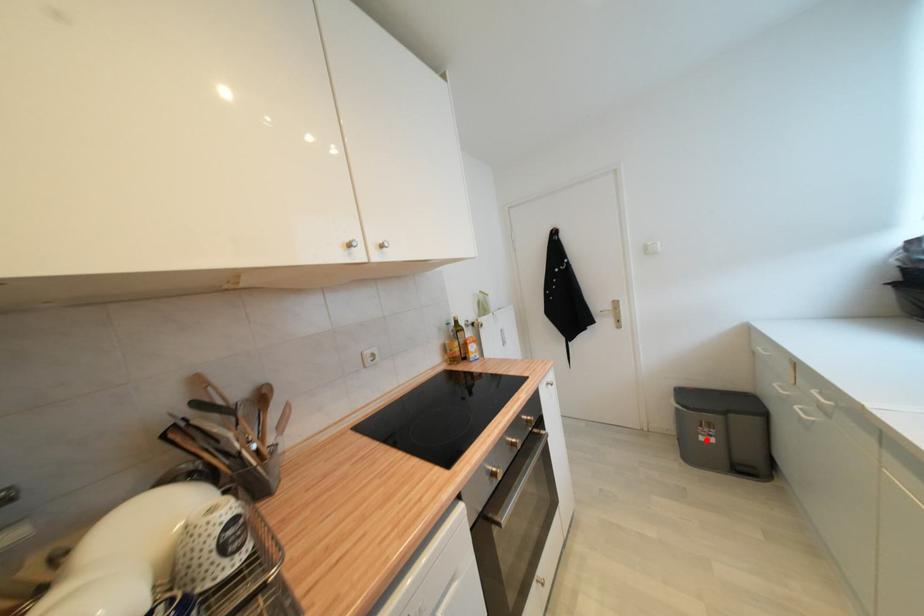
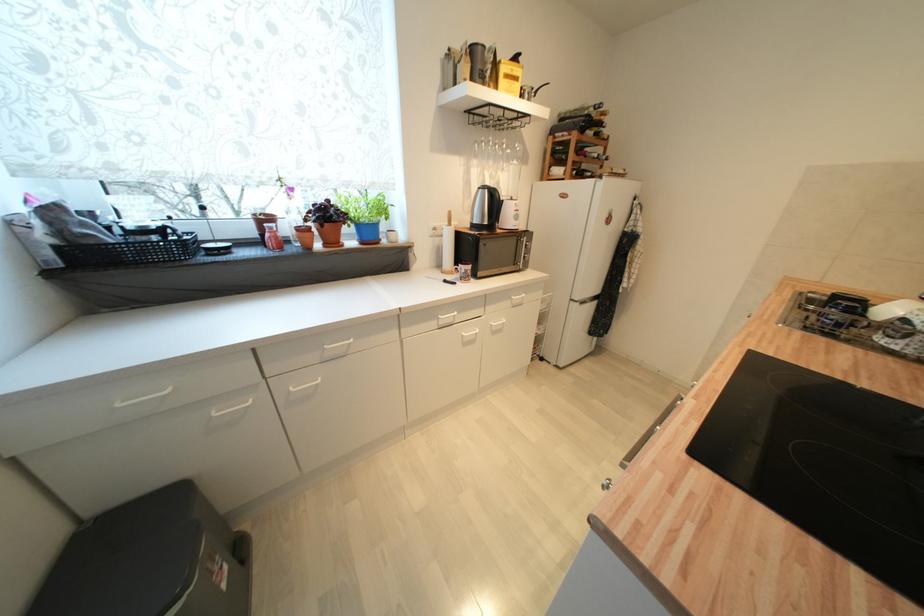
Find the pixel in the second image that matches the highlighted location in the first image.

(228, 588)